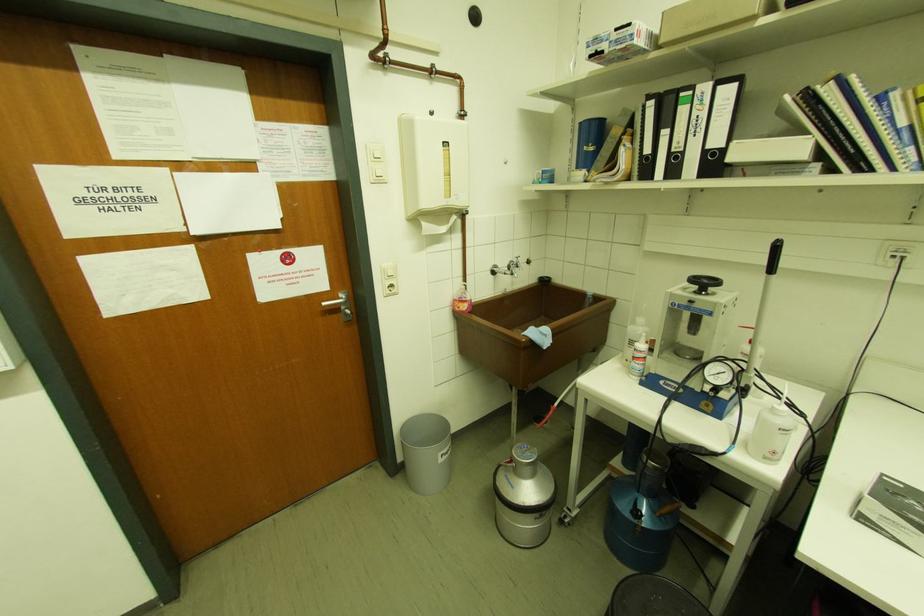
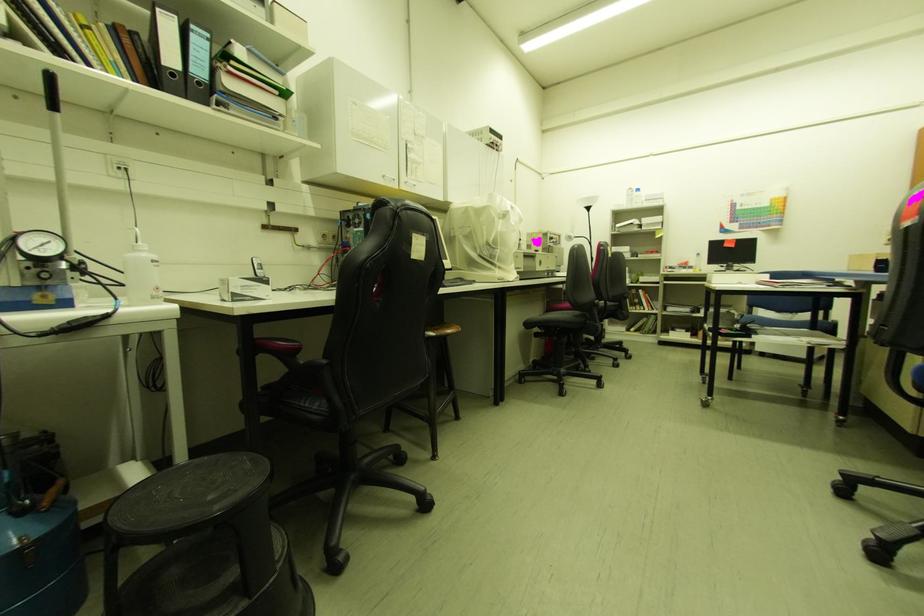
Question: The first image is from the beginning of the video and the second image is from the end. How did the camera likely rotate when shooting the video?

Choices:
 (A) Left
 (B) Right
 (C) Up
 (D) Down

Answer: (B)